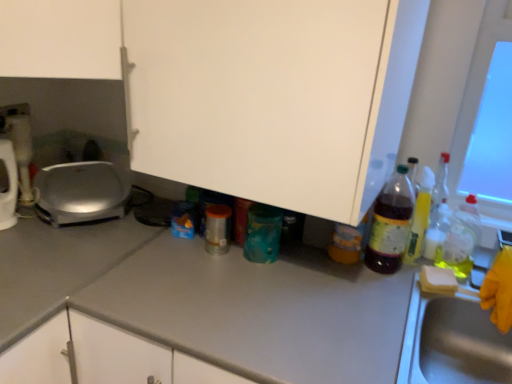
The height and width of the screenshot is (384, 512). I want to click on vacant point to the right of teal matte canister at center, the 4th bottle in the right-to-left sequence, so click(x=309, y=263).